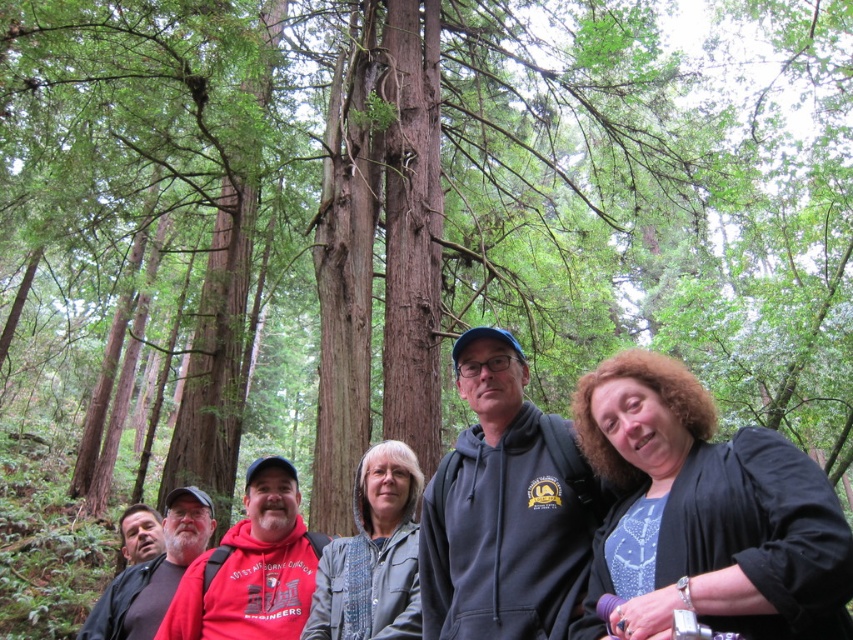
You are a photographer trying to capture a group photo in this forest scene. You notice the red fleece jacket at lower left and the gray textured jacket at center. Which jacket should you focus on if you want to highlight something taller in the frame?

The red fleece jacket at lower left is taller than the gray textured jacket at center, so focusing on it would highlight the taller jacket in the frame.

You are a photographer trying to capture a photo of the black matte jacket at lower right and the gray textured jacket at center. Based on their positions, which jacket is higher in the frame?

The black matte jacket at lower right is above the gray textured jacket at center, so it is higher in the frame.